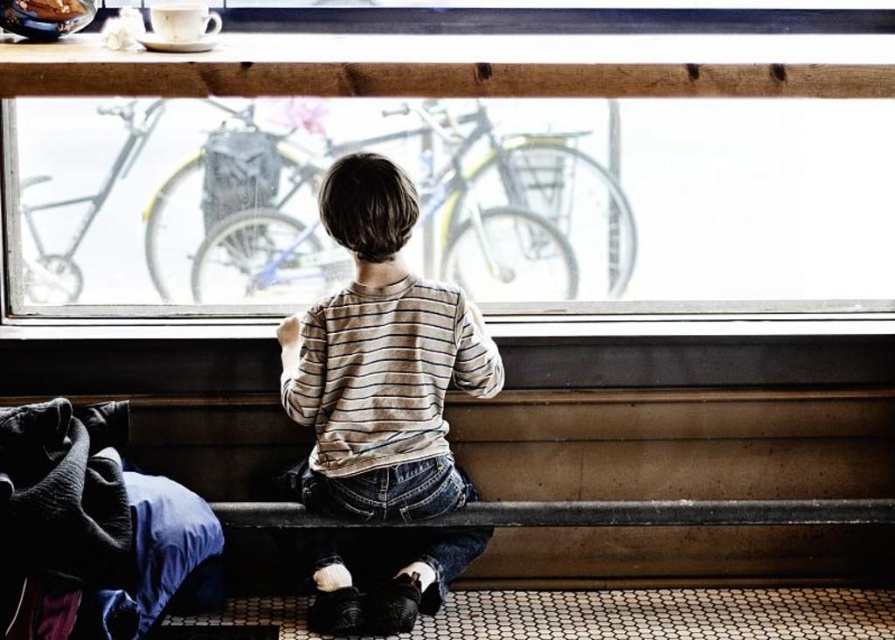
Measure the distance between clear glass window at center and velvet-like fabric at lower left.

A distance of 76.45 centimeters exists between clear glass window at center and velvet-like fabric at lower left.

Which is in front, point (175, 310) or point (99, 516)?

Point (99, 516) is in front.

This screenshot has height=640, width=895. Identify the location of clear glass window at center. (459, 173).

How far apart are clear glass window at center and striped cotton shirt at center?

clear glass window at center and striped cotton shirt at center are 21.63 inches apart.

Does clear glass window at center have a greater height compared to striped cotton shirt at center?

Incorrect, clear glass window at center's height is not larger of striped cotton shirt at center's.

Describe the element at coordinates (459, 173) in the screenshot. I see `clear glass window at center` at that location.

The width and height of the screenshot is (895, 640). I want to click on clear glass window at center, so click(459, 173).

Does smooth wooden bench at center appear on the left side of velvet-like fabric at lower left?

In fact, smooth wooden bench at center is to the right of velvet-like fabric at lower left.

Does smooth wooden bench at center appear over velvet-like fabric at lower left?

No, smooth wooden bench at center is not above velvet-like fabric at lower left.

This screenshot has width=895, height=640. Find the location of `smooth wooden bench at center`. smooth wooden bench at center is located at coordinates (678, 444).

Where is `smooth wooden bench at center`? smooth wooden bench at center is located at coordinates coord(678,444).